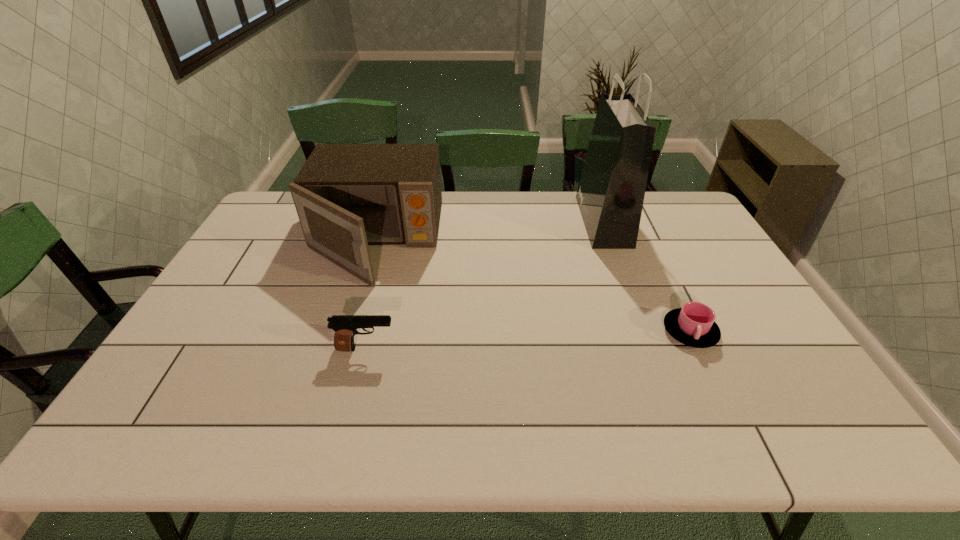
Image resolution: width=960 pixels, height=540 pixels. In order to click on shopping bag positioned at the far edge in this screenshot , I will do `click(610, 195)`.

You are a GUI agent. You are given a task and a screenshot of the screen. Output one action in this format:
    pyautogui.click(x=<x>, y=<y>)
    Task: Click on the microwave oven located in the far edge section of the desktop
    
    Given the screenshot: What is the action you would take?
    pyautogui.click(x=347, y=196)

Where is `object that is positioned at the right edge`? Image resolution: width=960 pixels, height=540 pixels. object that is positioned at the right edge is located at coordinates (694, 325).

The image size is (960, 540). I want to click on free space at the far edge, so click(x=515, y=209).

The height and width of the screenshot is (540, 960). In order to click on free region at the near edge of the desktop in this screenshot , I will do coord(706,438).

I want to click on vacant space at the left edge of the desktop, so coord(156,400).

This screenshot has height=540, width=960. Identify the location of free space at the right edge of the desktop. (677, 245).

Locate an element on the screen. The width and height of the screenshot is (960, 540). free space at the far right corner of the desktop is located at coordinates (682, 191).

This screenshot has width=960, height=540. I want to click on vacant point located between the tallest object and the shortest object, so click(647, 276).

This screenshot has height=540, width=960. I want to click on vacant region between the second tallest object and the tallest object, so click(489, 231).